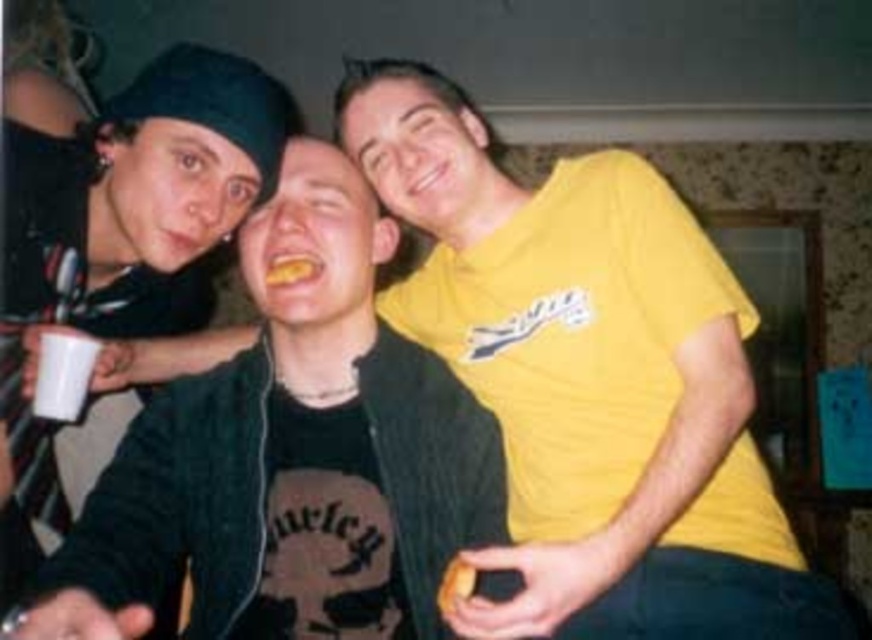
Question: Can you confirm if yellow cotton t-shirt at upper right is smaller than matte black jacket at center?

Choices:
 (A) yes
 (B) no

Answer: (B)

Question: Is the position of yellow cotton t-shirt at upper right less distant than that of matte black jacket at center?

Choices:
 (A) yes
 (B) no

Answer: (B)

Question: Is matte black jacket at center to the left of white plastic cup at lower left from the viewer's perspective?

Choices:
 (A) no
 (B) yes

Answer: (A)

Question: Estimate the real-world distances between objects in this image. Which object is closer to the yellow cotton t-shirt at upper right?

Choices:
 (A) matte black jacket at center
 (B) white plastic cup at lower left

Answer: (A)

Question: Which of the following is the closest to the observer?

Choices:
 (A) (801, 636)
 (B) (56, 371)

Answer: (A)

Question: Which point is farther to the camera?

Choices:
 (A) yellow cotton t-shirt at upper right
 (B) matte black jacket at center

Answer: (A)